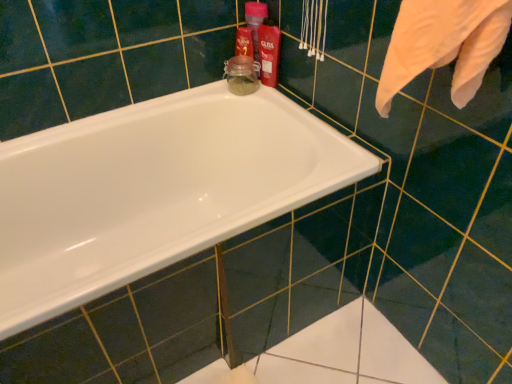
Question: Considering the relative sizes of matte plastic bottle at upper right, the first cleaning product in the back-to-front sequence, and shiny red plastic bottle at upper right, the second cleaning product positioned from the back, in the image provided, is matte plastic bottle at upper right, the first cleaning product in the back-to-front sequence, bigger than shiny red plastic bottle at upper right, the second cleaning product positioned from the back,?

Choices:
 (A) no
 (B) yes

Answer: (B)

Question: Is matte plastic bottle at upper right, the first cleaning product in the back-to-front sequence, further to camera compared to shiny red plastic bottle at upper right, which ranks as the first cleaning product in front-to-back order?

Choices:
 (A) no
 (B) yes

Answer: (B)

Question: From a real-world perspective, is matte plastic bottle at upper right, the 2th cleaning product when ordered from front to back, located beneath shiny red plastic bottle at upper right, the second cleaning product positioned from the back?

Choices:
 (A) no
 (B) yes

Answer: (B)

Question: From the image's perspective, would you say matte plastic bottle at upper right, the 2th cleaning product when ordered from front to back, is positioned over shiny red plastic bottle at upper right, the second cleaning product positioned from the back?

Choices:
 (A) no
 (B) yes

Answer: (B)

Question: From a real-world perspective, is matte plastic bottle at upper right, the first cleaning product in the back-to-front sequence, over shiny red plastic bottle at upper right, the second cleaning product positioned from the back?

Choices:
 (A) no
 (B) yes

Answer: (A)

Question: Is shiny red plastic bottle at upper right, the second cleaning product positioned from the back, surrounded by matte plastic bottle at upper right, the 2th cleaning product when ordered from front to back?

Choices:
 (A) no
 (B) yes

Answer: (A)

Question: Would you consider shiny red plastic bottle at upper right, which ranks as the first cleaning product in front-to-back order, to be distant from white glossy bathtub at center?

Choices:
 (A) yes
 (B) no

Answer: (B)

Question: Is shiny red plastic bottle at upper right, which ranks as the first cleaning product in front-to-back order, turned away from white glossy bathtub at center?

Choices:
 (A) no
 (B) yes

Answer: (A)

Question: From the image's perspective, would you say shiny red plastic bottle at upper right, which ranks as the first cleaning product in front-to-back order, is positioned over white glossy bathtub at center?

Choices:
 (A) no
 (B) yes

Answer: (B)

Question: Is shiny red plastic bottle at upper right, which ranks as the first cleaning product in front-to-back order, at the left side of white glossy bathtub at center?

Choices:
 (A) no
 (B) yes

Answer: (A)

Question: Can you confirm if shiny red plastic bottle at upper right, which ranks as the first cleaning product in front-to-back order, is taller than white glossy bathtub at center?

Choices:
 (A) no
 (B) yes

Answer: (A)

Question: Can you confirm if shiny red plastic bottle at upper right, the second cleaning product positioned from the back, is wider than white glossy bathtub at center?

Choices:
 (A) yes
 (B) no

Answer: (B)

Question: From a real-world perspective, is white glossy bathtub at center positioned over shiny red plastic bottle at upper right, the second cleaning product positioned from the back, based on gravity?

Choices:
 (A) yes
 (B) no

Answer: (B)